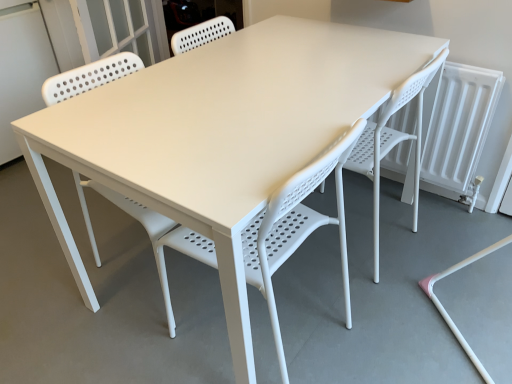
Question: Is white plastic chair at center, which appears as the second chair when viewed from the right, at the back of white plastic chair at center, which is counted as the 1th chair, starting from the right?

Choices:
 (A) no
 (B) yes

Answer: (A)

Question: Considering the relative sizes of white plastic chair at center, which is counted as the 1th chair, starting from the right, and white plastic chair at center, which appears as the second chair when viewed from the right, in the image provided, is white plastic chair at center, which is counted as the 1th chair, starting from the right, taller than white plastic chair at center, which appears as the second chair when viewed from the right,?

Choices:
 (A) yes
 (B) no

Answer: (A)

Question: Considering the relative positions of white plastic chair at center, which appears as the second chair when viewed from the left, and white plastic chair at center, which appears as the second chair when viewed from the right, in the image provided, is white plastic chair at center, which appears as the second chair when viewed from the left, to the left of white plastic chair at center, which appears as the second chair when viewed from the right, from the viewer's perspective?

Choices:
 (A) no
 (B) yes

Answer: (A)

Question: Does white plastic chair at center, which is counted as the 1th chair, starting from the right, have a larger size compared to white plastic chair at center, the 1th chair positioned from the left?

Choices:
 (A) yes
 (B) no

Answer: (A)

Question: Is white plastic chair at center, which is counted as the 1th chair, starting from the right, behind white plastic chair at center, which appears as the second chair when viewed from the right?

Choices:
 (A) yes
 (B) no

Answer: (A)

Question: Considering the relative sizes of white plastic chair at center, which is counted as the 1th chair, starting from the right, and white plastic chair at center, which appears as the second chair when viewed from the right, in the image provided, is white plastic chair at center, which is counted as the 1th chair, starting from the right, wider than white plastic chair at center, which appears as the second chair when viewed from the right,?

Choices:
 (A) no
 (B) yes

Answer: (B)

Question: Is white plastic screen door at upper left further to the viewer compared to white plastic chair at center, which is counted as the 1th chair, starting from the right?

Choices:
 (A) no
 (B) yes

Answer: (B)

Question: Is white plastic screen door at upper left facing away from white plastic chair at center, which is counted as the 1th chair, starting from the right?

Choices:
 (A) yes
 (B) no

Answer: (B)

Question: Can you see white plastic screen door at upper left touching white plastic chair at center, which appears as the second chair when viewed from the left?

Choices:
 (A) yes
 (B) no

Answer: (B)

Question: Is white plastic screen door at upper left taller than white plastic chair at center, which appears as the second chair when viewed from the left?

Choices:
 (A) yes
 (B) no

Answer: (A)

Question: Is white plastic screen door at upper left far from white plastic chair at center, which is counted as the 1th chair, starting from the right?

Choices:
 (A) no
 (B) yes

Answer: (B)

Question: Can you confirm if white plastic screen door at upper left is wider than white plastic chair at center, which appears as the second chair when viewed from the left?

Choices:
 (A) no
 (B) yes

Answer: (B)

Question: From a real-world perspective, is white plastic chair at center, the 1th chair positioned from the left, under white plastic chair at center, which appears as the second chair when viewed from the left?

Choices:
 (A) yes
 (B) no

Answer: (B)